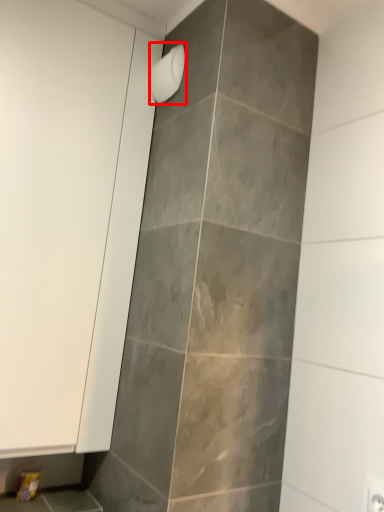
Question: In this image, where is shower (annotated by the red box) located relative to screen door?

Choices:
 (A) left
 (B) right

Answer: (B)